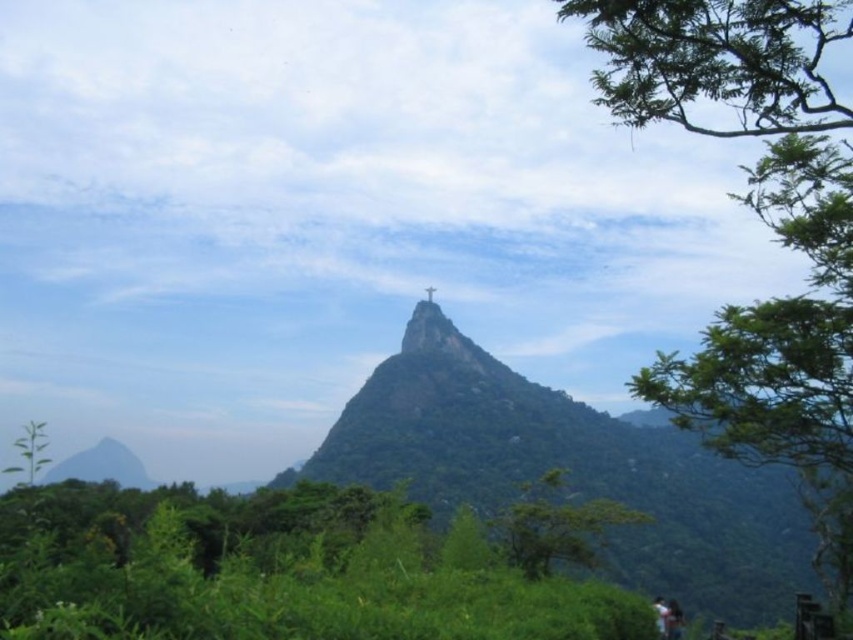
Is point (828, 285) farther from camera compared to point (450, 340)?

No, (828, 285) is closer to viewer.

Is point (834, 381) closer to camera compared to point (448, 348)?

That is True.

Is point (608, 72) in front of point (418, 349)?

Yes.

The height and width of the screenshot is (640, 853). What are the coordinates of `green leafy tree at upper right` in the screenshot? It's located at (764, 221).

Measure the distance between point (683, 490) and camera.

The distance of point (683, 490) from camera is 151.29 meters.

Which of these two, green rocky hill at center or white fabric person at center, stands taller?

With more height is green rocky hill at center.

Does point (689, 513) lie behind point (657, 596)?

That is True.

The image size is (853, 640). What are the coordinates of `green rocky hill at center` in the screenshot? It's located at (578, 477).

Is green leafy tree at upper right smaller than light brown wooden bench at lower right?

No, green leafy tree at upper right is not smaller than light brown wooden bench at lower right.

Is point (833, 161) in front of point (666, 602)?

Yes, it is in front of point (666, 602).

The height and width of the screenshot is (640, 853). Identify the location of green leafy tree at upper right. (764, 221).